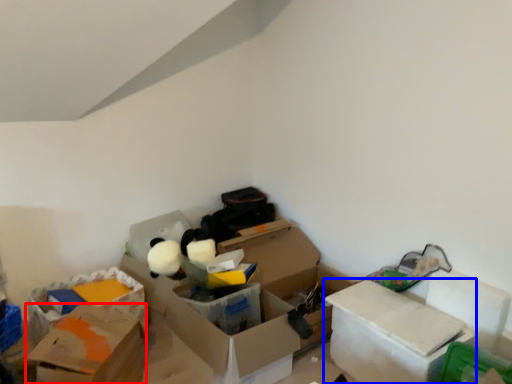
Question: Among these objects, which one is farthest to the camera, box (highlighted by a red box) or box (highlighted by a blue box)?

Choices:
 (A) box
 (B) box

Answer: (B)